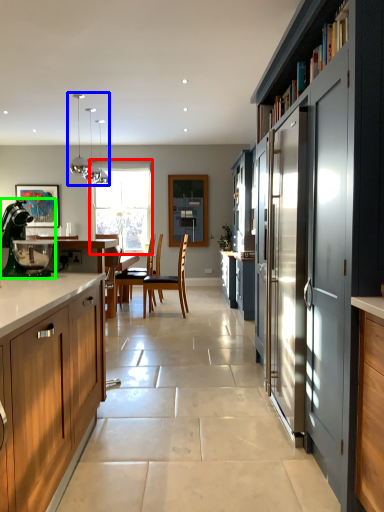
Question: Which object is positioned closest to window (highlighted by a red box)? Select from light fixture (highlighted by a blue box) and kitchen appliance (highlighted by a green box).

Choices:
 (A) light fixture
 (B) kitchen appliance

Answer: (A)